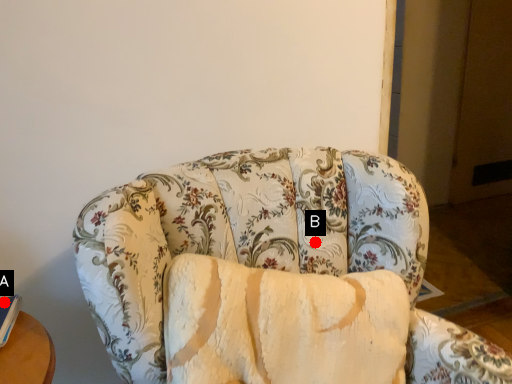
Question: Two points are circled on the image, labeled by A and B beside each circle. Which point is closer to the camera?

Choices:
 (A) A is closer
 (B) B is closer

Answer: (A)